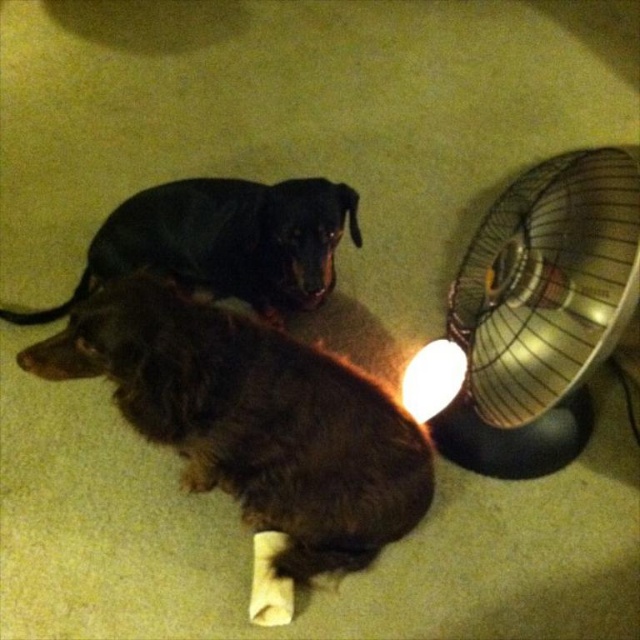
Does point (442, 422) come closer to viewer compared to point (248, 236)?

Yes.

The width and height of the screenshot is (640, 640). Describe the element at coordinates (540, 312) in the screenshot. I see `metallic gold fan at right` at that location.

Which is in front, point (452, 445) or point (220, 202)?

Point (452, 445) is in front.

This screenshot has width=640, height=640. I want to click on metallic gold fan at right, so click(x=540, y=312).

Consider the image. Is black smooth dog at upper center thinner than white glossy lampshade at lower right?

No.

Does point (104, 244) come in front of point (416, 378)?

No.

Does point (296, 268) come behind point (428, 410)?

Yes.

You are a GUI agent. You are given a task and a screenshot of the screen. Output one action in this format:
    pyautogui.click(x=<x>, y=<y>)
    Task: Click on the black smooth dog at upper center
    The image size is (640, 640).
    Given the screenshot: What is the action you would take?
    pyautogui.click(x=224, y=241)

Is brown fuzzy dog at lower left in front of white glossy lampshade at lower right?

Yes, it is.

Who is lower down, brown fuzzy dog at lower left or white glossy lampshade at lower right?

brown fuzzy dog at lower left

Find the location of a particular element. This screenshot has width=640, height=640. brown fuzzy dog at lower left is located at coordinates (253, 420).